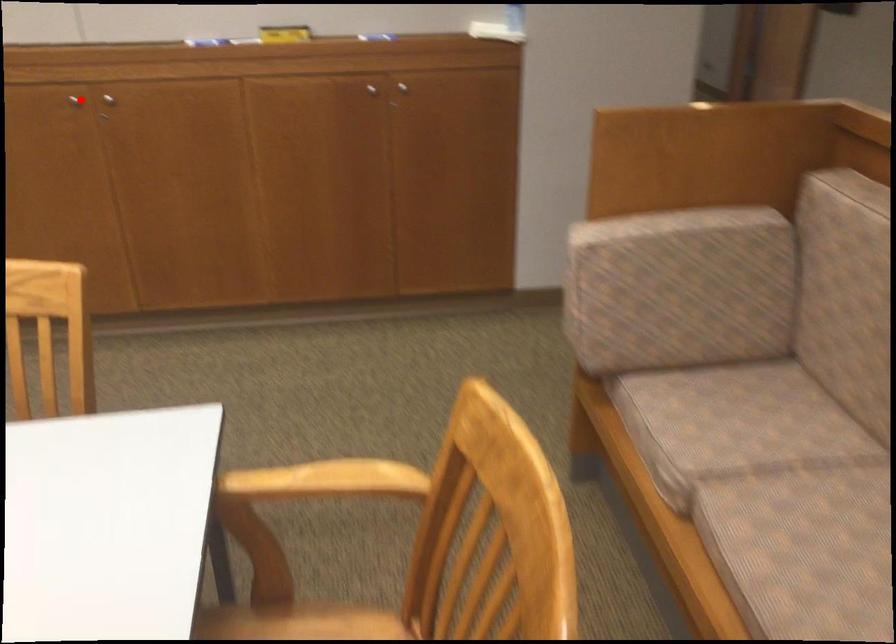
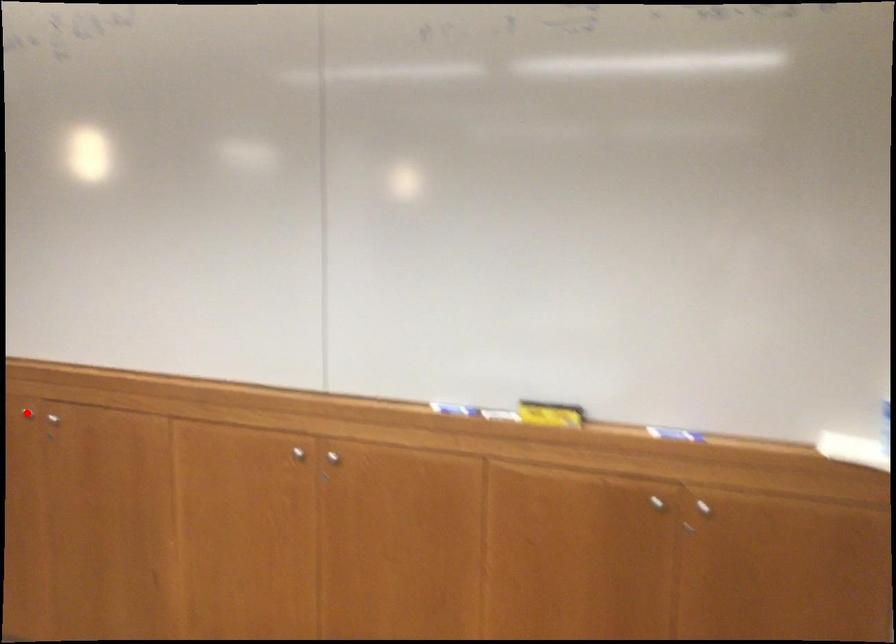
I am providing you with two images of the same scene from different viewpoints. A red point is marked on the first image and another point is marked on the second image. Is the marked point in image1 the same physical position as the marked point in image2?

No